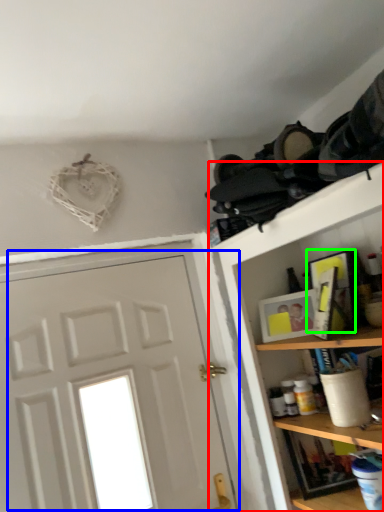
Question: Which object is the farthest from shelf (highlighted by a red box)? Choose among these: door (highlighted by a blue box) or picture frame (highlighted by a green box).

Choices:
 (A) door
 (B) picture frame

Answer: (A)